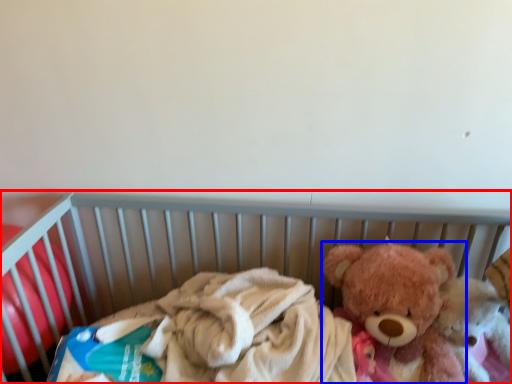
Question: Which of the following is the farthest to the observer, infant bed (highlighted by a red box) or teddy bear (highlighted by a blue box)?

Choices:
 (A) infant bed
 (B) teddy bear

Answer: (B)